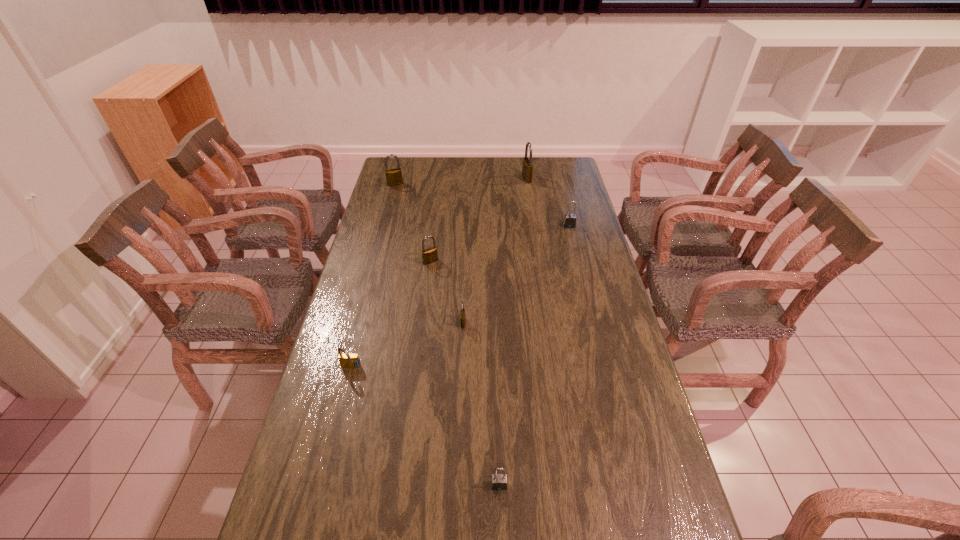
At what (x,y) coordinates should I click in order to perform the action: click on the nearest object. Please return your answer as a coordinate pair (x, y). Looking at the image, I should click on (498, 481).

I want to click on the fourth padlock from right to left, so click(462, 313).

This screenshot has width=960, height=540. What are the coordinates of `the nearest brass padlock` in the screenshot? It's located at (462, 313).

Locate an element on the screen. This screenshot has height=540, width=960. free region located on the right of the rightmost brass padlock is located at coordinates (567, 179).

You are a GUI agent. You are given a task and a screenshot of the screen. Output one action in this format:
    pyautogui.click(x=<x>, y=<y>)
    Task: Click on the vacant area situated on the back of the second tallest padlock
    Image resolution: width=960 pixels, height=540 pixels.
    Given the screenshot: What is the action you would take?
    pyautogui.click(x=399, y=168)

Image resolution: width=960 pixels, height=540 pixels. What are the coordinates of `vacant space situated on the shackle of the farther gray padlock` in the screenshot? It's located at (580, 269).

This screenshot has width=960, height=540. What are the coordinates of `vacant space located 0.130m on the left of the second brass padlock from left to right` in the screenshot? It's located at (388, 261).

This screenshot has height=540, width=960. I want to click on free spot located on the side with the combination dials of the second nearest padlock, so click(332, 443).

This screenshot has width=960, height=540. I want to click on free space located 0.100m on the shackle of the third object from right to left, so click(501, 538).

Identify the location of free location located 0.100m on the back of the nearest brass padlock. The image size is (960, 540). (464, 296).